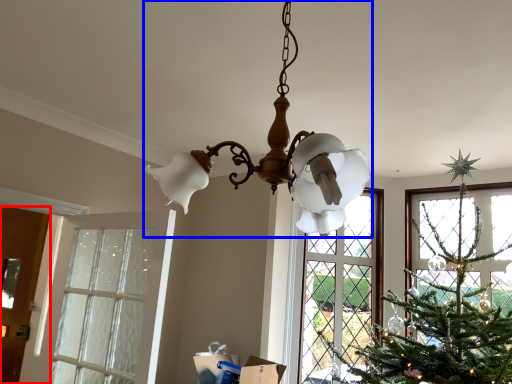
Question: Which object appears closest to the camera in this image, door (highlighted by a red box) or lamp (highlighted by a blue box)?

Choices:
 (A) door
 (B) lamp

Answer: (B)